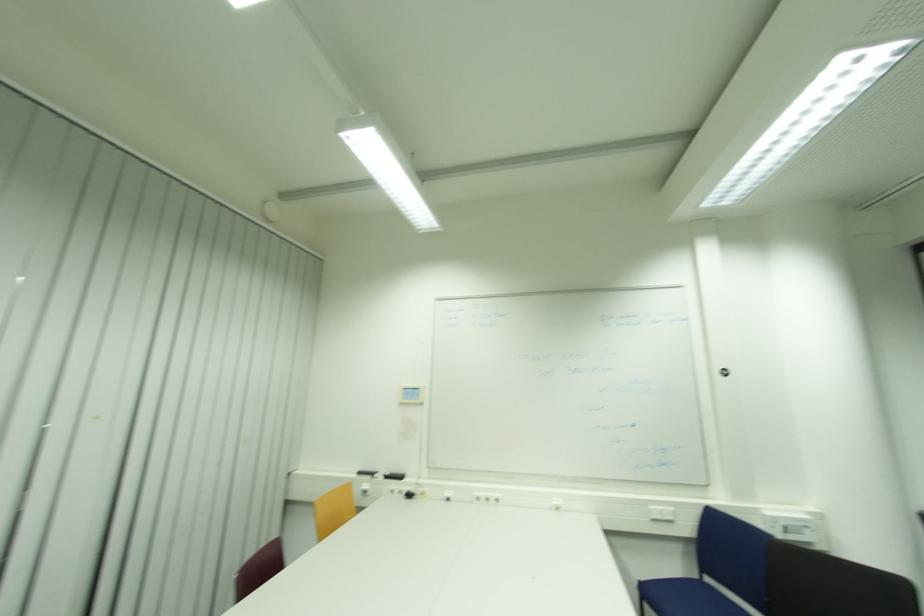
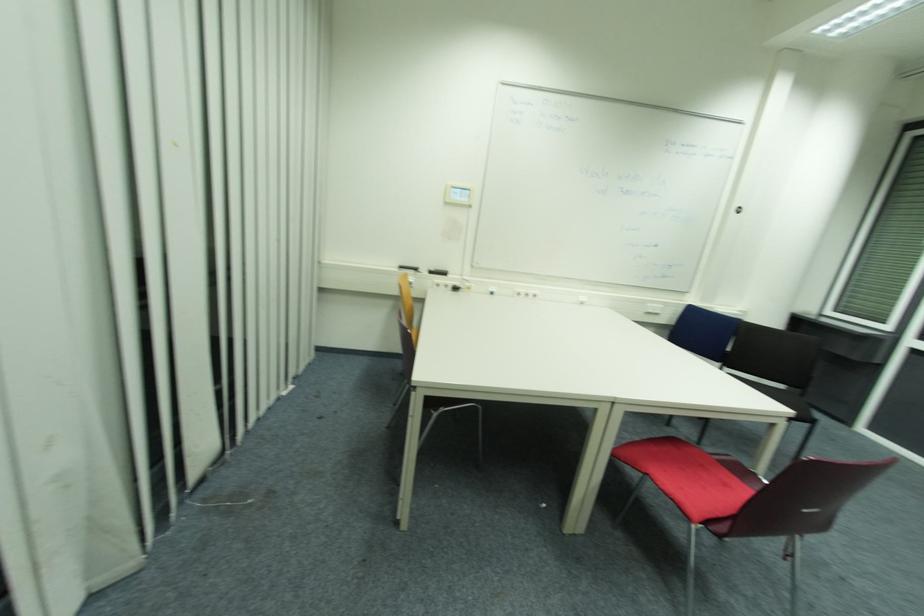
In the second image, find the point that corresponds to (x=414, y=496) in the first image.

(458, 290)